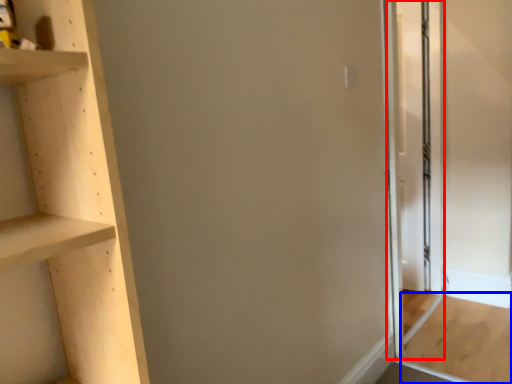
Question: Which of the following is the farthest to the observer, screen door (highlighted by a red box) or plywood (highlighted by a blue box)?

Choices:
 (A) screen door
 (B) plywood

Answer: (A)